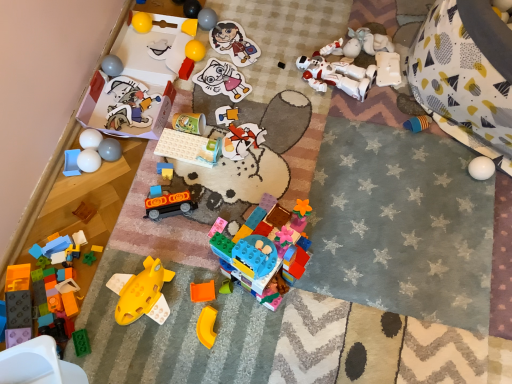
Locate an element on the screen. The image size is (512, 384). blank space to the left of matte plastic sticker at upper center, marked as the fourth toy in a right-to-left arrangement is located at coordinates (191, 60).